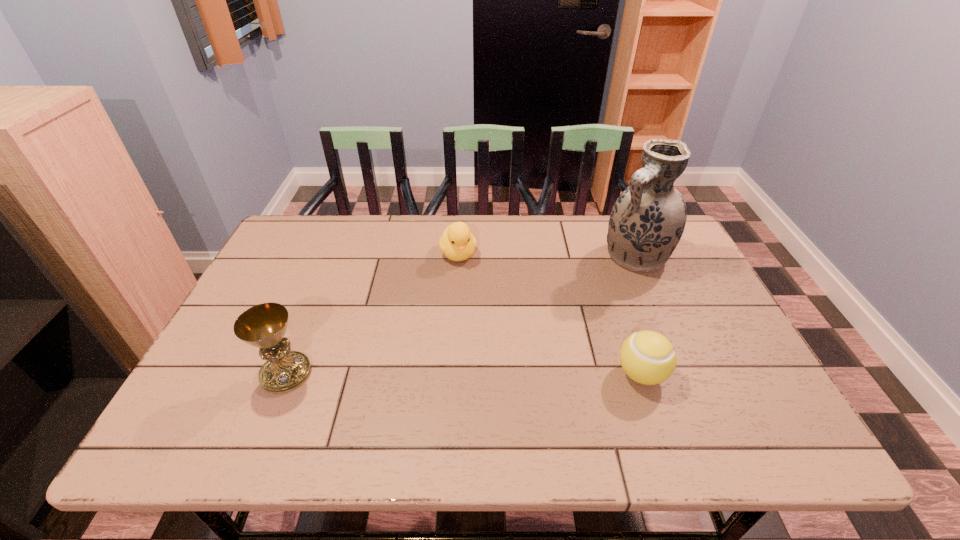
The height and width of the screenshot is (540, 960). I want to click on vacant space positioned with the handle on the side of the tallest object, so click(x=567, y=313).

Find the location of `free space located with the handle on the side of the tallest object`. free space located with the handle on the side of the tallest object is located at coordinates (591, 293).

Identify the location of free space located 0.140m with the handle on the side of the tallest object. (589, 294).

Where is `duck located at the far edge`? The height and width of the screenshot is (540, 960). duck located at the far edge is located at coordinates (457, 243).

At what (x,y) coordinates should I click in order to perform the action: click on vase present at the far edge. Please return your answer as a coordinate pair (x, y). The image size is (960, 540). Looking at the image, I should click on (647, 221).

Identify the location of chalice that is positioned at the near edge. (264, 325).

Where is `tennis ball that is at the near edge`? Image resolution: width=960 pixels, height=540 pixels. tennis ball that is at the near edge is located at coordinates (647, 357).

In order to click on object located at the left edge in this screenshot , I will do `click(264, 325)`.

The height and width of the screenshot is (540, 960). What are the coordinates of `object situated at the right edge` in the screenshot? It's located at (647, 221).

The width and height of the screenshot is (960, 540). Identify the location of object at the near left corner. (264, 325).